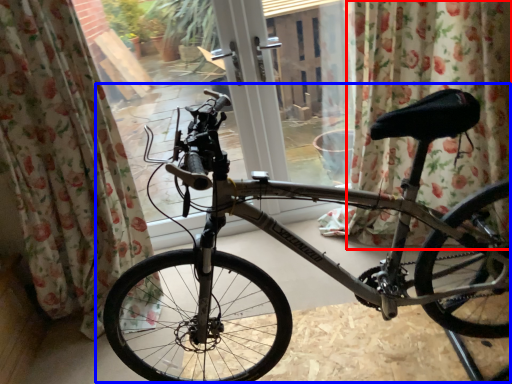
Question: Which point is closer to the camera, curtain (highlighted by a red box) or bicycle (highlighted by a blue box)?

Choices:
 (A) curtain
 (B) bicycle

Answer: (B)